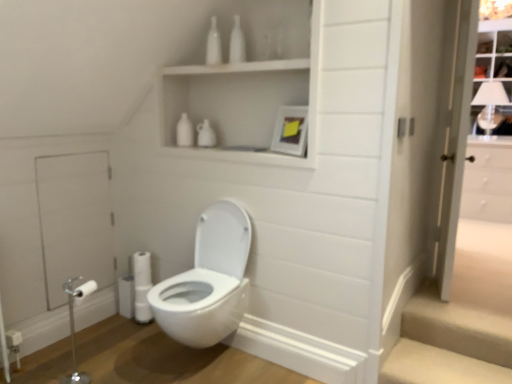
Question: Does white glossy bottles at upper center, arranged as the first toiletry when viewed from the right, appear on the right side of white glossy bottle at upper center, marked as the second toiletry in a right-to-left arrangement?

Choices:
 (A) no
 (B) yes

Answer: (B)

Question: From the image's perspective, is white glossy bottles at upper center, arranged as the first toiletry when viewed from the right, located above white glossy bottle at upper center, marked as the second toiletry in a right-to-left arrangement?

Choices:
 (A) yes
 (B) no

Answer: (A)

Question: Is white glossy bottles at upper center, arranged as the first toiletry when viewed from the right, outside of white glossy bottle at upper center, marked as the second toiletry in a right-to-left arrangement?

Choices:
 (A) yes
 (B) no

Answer: (A)

Question: Is white glossy bottles at upper center, arranged as the first toiletry when viewed from the right, touching white glossy bottle at upper center, placed as the 1th toiletry when sorted from left to right?

Choices:
 (A) yes
 (B) no

Answer: (A)

Question: Considering the relative sizes of white glossy bottles at upper center, arranged as the first toiletry when viewed from the right, and white glossy bottle at upper center, marked as the second toiletry in a right-to-left arrangement, in the image provided, is white glossy bottles at upper center, arranged as the first toiletry when viewed from the right, thinner than white glossy bottle at upper center, marked as the second toiletry in a right-to-left arrangement,?

Choices:
 (A) no
 (B) yes

Answer: (A)

Question: Is white glossy bottles at upper center, arranged as the first toiletry when viewed from the right, further to camera compared to white glossy bottle at upper center, marked as the second toiletry in a right-to-left arrangement?

Choices:
 (A) no
 (B) yes

Answer: (A)

Question: Does white matte toilet paper at lower left have a lesser width compared to silver metallic toilet paper holder at lower left?

Choices:
 (A) no
 (B) yes

Answer: (B)

Question: Is white matte toilet paper at lower left oriented towards silver metallic toilet paper holder at lower left?

Choices:
 (A) no
 (B) yes

Answer: (B)

Question: Is the depth of white matte toilet paper at lower left greater than that of silver metallic toilet paper holder at lower left?

Choices:
 (A) yes
 (B) no

Answer: (A)

Question: Does white matte toilet paper at lower left lie in front of silver metallic toilet paper holder at lower left?

Choices:
 (A) yes
 (B) no

Answer: (B)

Question: Considering the relative sizes of white matte toilet paper at lower left and silver metallic toilet paper holder at lower left in the image provided, is white matte toilet paper at lower left taller than silver metallic toilet paper holder at lower left?

Choices:
 (A) no
 (B) yes

Answer: (A)

Question: From a real-world perspective, does white matte toilet paper at lower left stand above silver metallic toilet paper holder at lower left?

Choices:
 (A) yes
 (B) no

Answer: (A)

Question: Considering the relative positions of beige carpeted stairs at lower right and white glossy door at right in the image provided, is beige carpeted stairs at lower right to the left of white glossy door at right from the viewer's perspective?

Choices:
 (A) yes
 (B) no

Answer: (B)